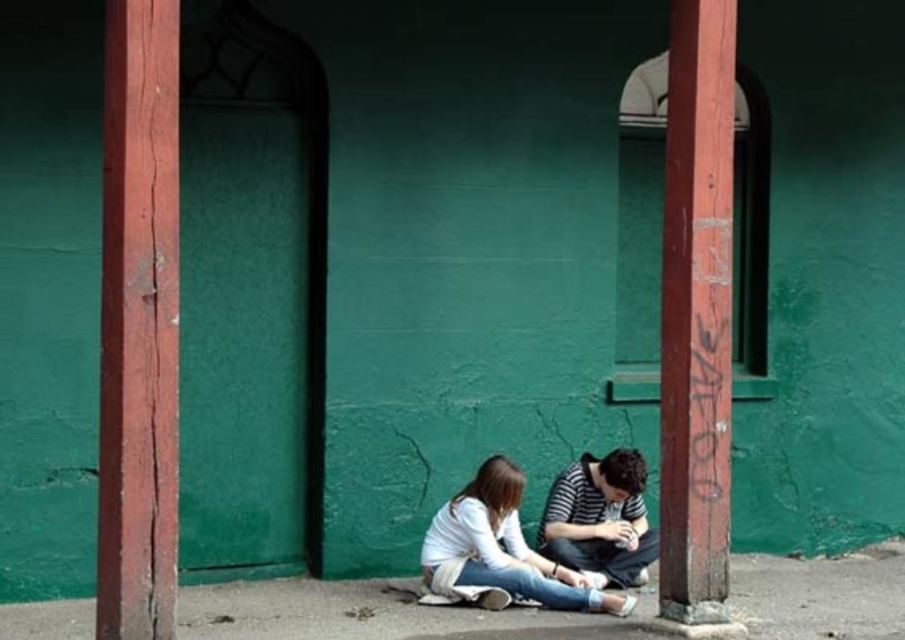
Between rusty wood post at right and concrete pavement at lower center, which one appears on the right side from the viewer's perspective?

From the viewer's perspective, rusty wood post at right appears more on the right side.

Which is behind, point (686, 106) or point (70, 618)?

Point (70, 618)

Where is `rusty wood post at right`? This screenshot has height=640, width=905. rusty wood post at right is located at coordinates (696, 314).

Who is positioned more to the right, smooth red wood at left or striped cotton shirt at lower center?

striped cotton shirt at lower center is more to the right.

Is point (141, 545) farther from camera compared to point (624, 579)?

No, (141, 545) is in front of (624, 579).

The width and height of the screenshot is (905, 640). What do you see at coordinates (138, 323) in the screenshot?
I see `smooth red wood at left` at bounding box center [138, 323].

The height and width of the screenshot is (640, 905). I want to click on smooth red wood at left, so click(x=138, y=323).

Does rusty wood post at right have a greater width compared to white cotton shirt at center?

In fact, rusty wood post at right might be narrower than white cotton shirt at center.

At what (x,y) coordinates should I click in order to perform the action: click on rusty wood post at right. Please return your answer as a coordinate pair (x, y). The width and height of the screenshot is (905, 640). Looking at the image, I should click on (696, 314).

At what (x,y) coordinates should I click in order to perform the action: click on rusty wood post at right. Please return your answer as a coordinate pair (x, y). Looking at the image, I should click on (696, 314).